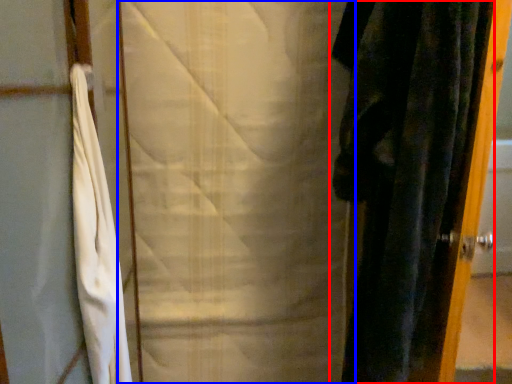
Question: Which point is closer to the camera, curtain (highlighted by a red box) or curtain (highlighted by a blue box)?

Choices:
 (A) curtain
 (B) curtain

Answer: (A)